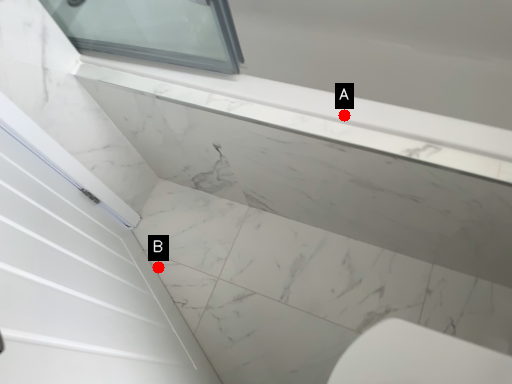
Question: Two points are circled on the image, labeled by A and B beside each circle. Which of the following is the closest to the observer?

Choices:
 (A) A is closer
 (B) B is closer

Answer: (A)